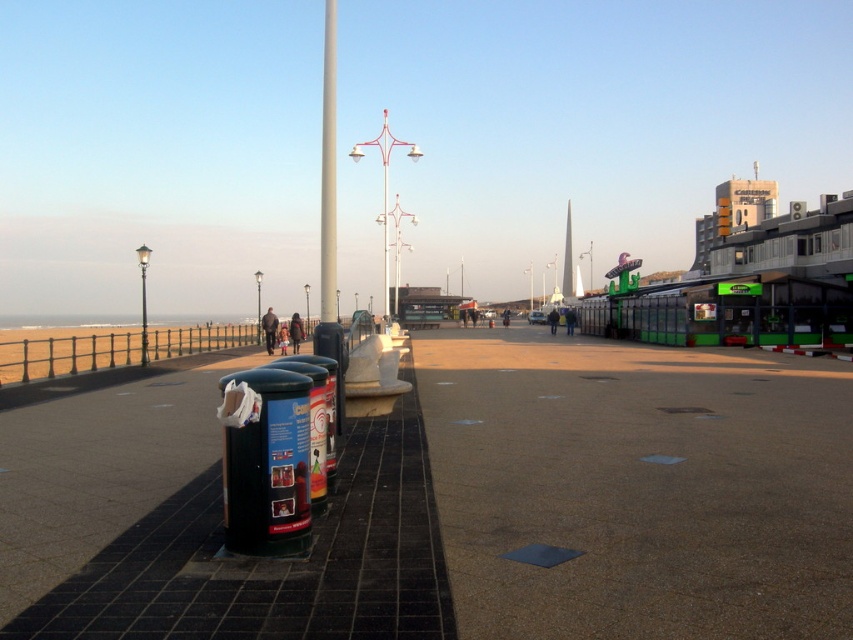
You are a maintenance worker assigned to check the brown textured pavement at center and the metallic pole at center. Which object requires more space to work around due to its size?

The metallic pole at center requires more space to work around because it is larger than the brown textured pavement at center.